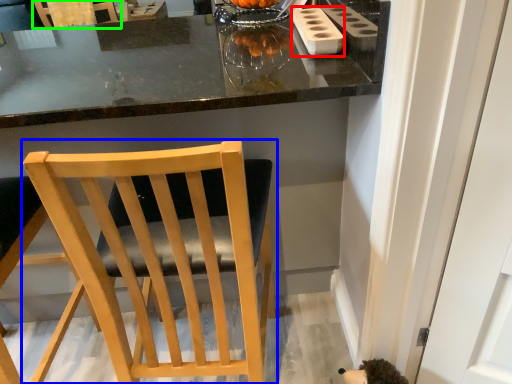
Question: Which object is the closest to the appliance (highlighted by a red box)? Choose among these: chair (highlighted by a blue box) or chair (highlighted by a green box).

Choices:
 (A) chair
 (B) chair

Answer: (A)